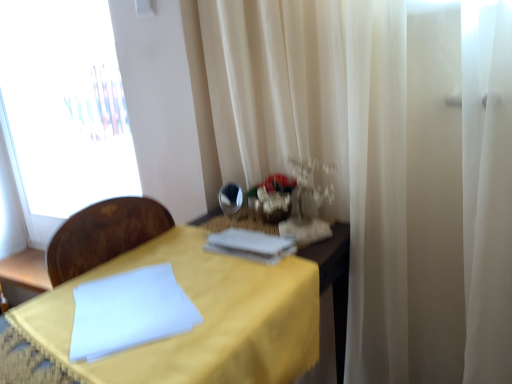
Question: Is white paper at center far from yellow fabric table at center?

Choices:
 (A) yes
 (B) no

Answer: (B)

Question: From the image's perspective, is white paper at center over yellow fabric table at center?

Choices:
 (A) yes
 (B) no

Answer: (A)

Question: Could you tell me if white paper at center is turned towards yellow fabric table at center?

Choices:
 (A) no
 (B) yes

Answer: (A)

Question: Considering the relative sizes of white paper at center and yellow fabric table at center in the image provided, is white paper at center shorter than yellow fabric table at center?

Choices:
 (A) yes
 (B) no

Answer: (A)

Question: Is white paper at center touching yellow fabric table at center?

Choices:
 (A) no
 (B) yes

Answer: (A)

Question: Is white paper at center positioned with its back to yellow fabric table at center?

Choices:
 (A) no
 (B) yes

Answer: (A)

Question: Are white paper at center and shiny silver mirror at center far apart?

Choices:
 (A) yes
 (B) no

Answer: (B)

Question: From a real-world perspective, is white paper at center physically below shiny silver mirror at center?

Choices:
 (A) yes
 (B) no

Answer: (A)

Question: From the image's perspective, is white paper at center under shiny silver mirror at center?

Choices:
 (A) yes
 (B) no

Answer: (A)

Question: Does white paper at center turn towards shiny silver mirror at center?

Choices:
 (A) yes
 (B) no

Answer: (B)

Question: Considering the relative positions of white paper at center and shiny silver mirror at center in the image provided, is white paper at center to the right of shiny silver mirror at center from the viewer's perspective?

Choices:
 (A) no
 (B) yes

Answer: (B)

Question: Is white paper at center facing away from shiny silver mirror at center?

Choices:
 (A) no
 (B) yes

Answer: (B)

Question: Considering the relative sizes of shiny silver mirror at center and yellow fabric table at center in the image provided, is shiny silver mirror at center smaller than yellow fabric table at center?

Choices:
 (A) yes
 (B) no

Answer: (A)